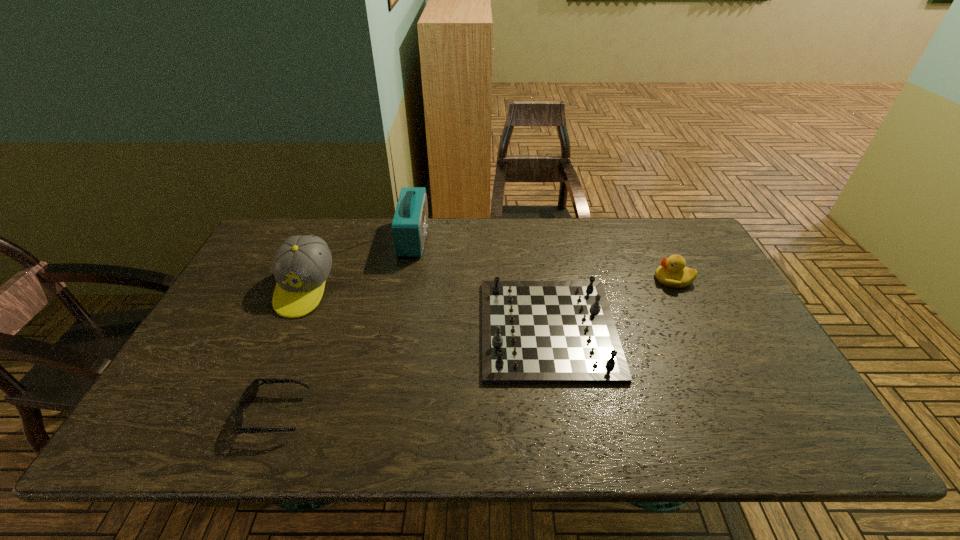
This screenshot has width=960, height=540. In order to click on radio receiver in this screenshot , I will do click(x=410, y=222).

Identify the location of the third object from right to left. Image resolution: width=960 pixels, height=540 pixels. (410, 222).

At what (x,y) coordinates should I click in order to perform the action: click on baseball cap. Please return your answer as a coordinate pair (x, y). Looking at the image, I should click on [302, 264].

Image resolution: width=960 pixels, height=540 pixels. In order to click on duckling in this screenshot , I will do `click(672, 272)`.

I want to click on the third tallest object, so click(672, 272).

Find the location of a particular element. the second shortest object is located at coordinates (533, 332).

Locate an element on the screen. The width and height of the screenshot is (960, 540). chessboard is located at coordinates (533, 332).

The width and height of the screenshot is (960, 540). Identify the location of sunglasses. (250, 393).

The height and width of the screenshot is (540, 960). Find the location of `the shortest object`. the shortest object is located at coordinates (250, 393).

Where is `blank space located 0.170m on the front panel of the radio receiver`? blank space located 0.170m on the front panel of the radio receiver is located at coordinates (479, 238).